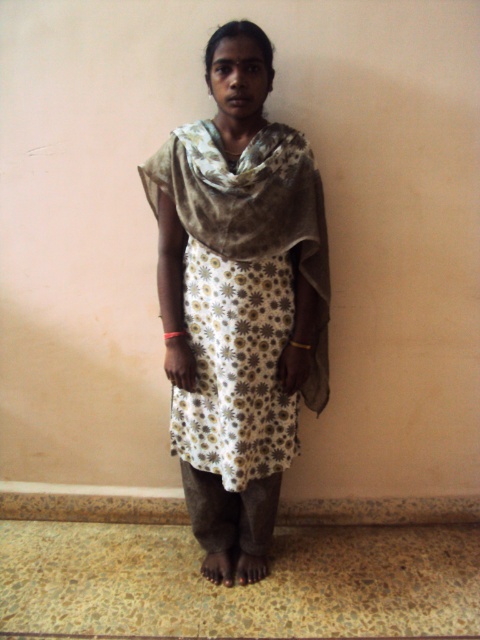
Question: Considering the relative positions of floral fabric dress at center and white floral fabric dress at center in the image provided, where is floral fabric dress at center located with respect to white floral fabric dress at center?

Choices:
 (A) right
 (B) left

Answer: (A)

Question: Does floral fabric dress at center appear under white floral fabric dress at center?

Choices:
 (A) no
 (B) yes

Answer: (A)

Question: Which of the following is the farthest from the observer?

Choices:
 (A) (276, 380)
 (B) (289, 307)

Answer: (A)

Question: Where is floral fabric dress at center located in relation to white floral fabric dress at center in the image?

Choices:
 (A) below
 (B) above

Answer: (B)